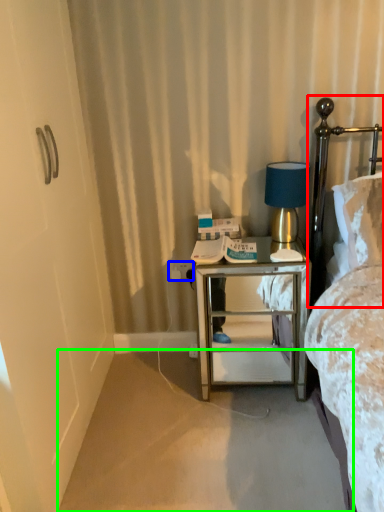
Question: Which object is the farthest from headboard (highlighted by a red box)? Choose among these: electric outlet (highlighted by a blue box) or plain (highlighted by a green box).

Choices:
 (A) electric outlet
 (B) plain

Answer: (B)